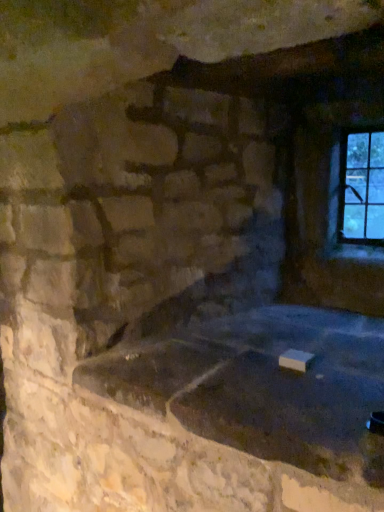
Describe the element at coordinates (360, 187) in the screenshot. The width and height of the screenshot is (384, 512). I see `clear glass window at upper right` at that location.

You are a GUI agent. You are given a task and a screenshot of the screen. Output one action in this format:
    pyautogui.click(x=<x>, y=<y>)
    Task: Click on the clear glass window at upper right
    This screenshot has width=384, height=512.
    Given the screenshot: What is the action you would take?
    pyautogui.click(x=360, y=187)

Image resolution: width=384 pixels, height=512 pixels. I want to click on clear glass window at upper right, so click(360, 187).